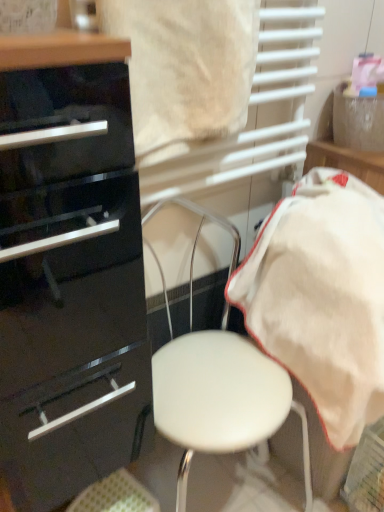
Question: From a real-world perspective, is white cotton towel at right beneath glossy black chest of drawers at left?

Choices:
 (A) no
 (B) yes

Answer: (B)

Question: Is white cotton towel at right wider than glossy black chest of drawers at left?

Choices:
 (A) no
 (B) yes

Answer: (B)

Question: Is white cotton towel at right shorter than glossy black chest of drawers at left?

Choices:
 (A) yes
 (B) no

Answer: (A)

Question: From the image's perspective, is white cotton towel at right below glossy black chest of drawers at left?

Choices:
 (A) yes
 (B) no

Answer: (B)

Question: Is white cotton towel at right to the right of glossy black chest of drawers at left from the viewer's perspective?

Choices:
 (A) no
 (B) yes

Answer: (B)

Question: From the image's perspective, relative to white cotton towel at right, is glossy black chest of drawers at left above or below?

Choices:
 (A) above
 (B) below

Answer: (B)

Question: Is glossy black chest of drawers at left taller or shorter than white cotton towel at right?

Choices:
 (A) short
 (B) tall

Answer: (B)

Question: Considering their positions, is glossy black chest of drawers at left located in front of or behind white cotton towel at right?

Choices:
 (A) behind
 (B) front

Answer: (B)

Question: Considering the positions of glossy black chest of drawers at left and white cotton towel at right in the image, is glossy black chest of drawers at left wider or thinner than white cotton towel at right?

Choices:
 (A) wide
 (B) thin

Answer: (B)

Question: Based on their sizes in the image, would you say white cotton towel at right is bigger or smaller than white leather stool at center?

Choices:
 (A) big
 (B) small

Answer: (B)

Question: Is point (276, 327) positioned closer to the camera than point (185, 373)?

Choices:
 (A) farther
 (B) closer

Answer: (A)

Question: Is white cotton towel at right to the left or to the right of white leather stool at center in the image?

Choices:
 (A) left
 (B) right

Answer: (B)

Question: In terms of width, does white cotton towel at right look wider or thinner when compared to white leather stool at center?

Choices:
 (A) wide
 (B) thin

Answer: (A)

Question: Looking at their shapes, would you say white leather stool at center is wider or thinner than white cotton towel at right?

Choices:
 (A) thin
 (B) wide

Answer: (A)

Question: In terms of height, does white leather stool at center look taller or shorter compared to white cotton towel at right?

Choices:
 (A) short
 (B) tall

Answer: (B)